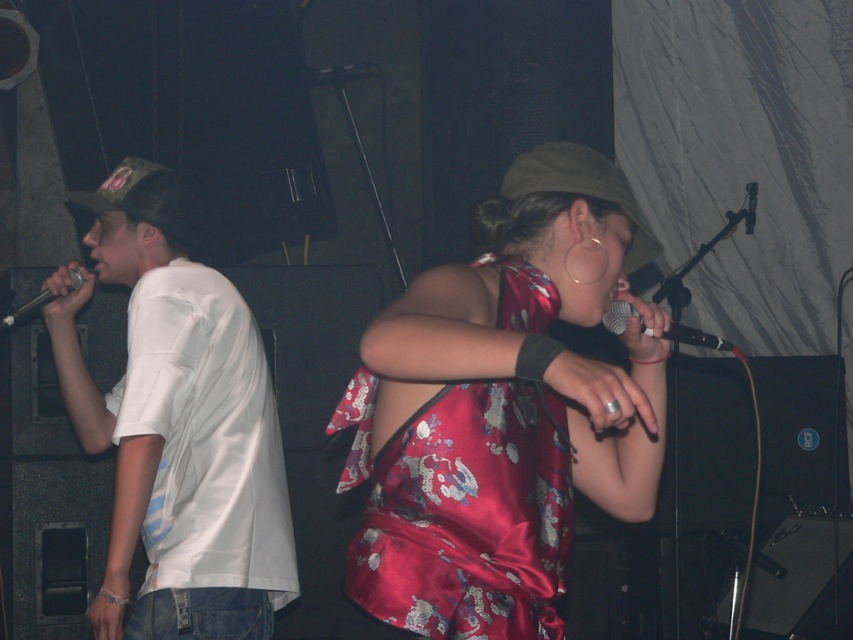
Is white satin shirt at left shorter than matte black microphone at left?

Incorrect, white satin shirt at left's height does not fall short of matte black microphone at left's.

Does point (62, 307) come farther from viewer compared to point (39, 304)?

No, (62, 307) is closer to viewer.

At what (x,y) coordinates should I click in order to perform the action: click on white satin shirt at left. Please return your answer as a coordinate pair (x, y). The height and width of the screenshot is (640, 853). Looking at the image, I should click on coord(177,424).

Is satin dress at center positioned before black matte microphone at center?

Yes, satin dress at center is closer to the viewer.

Which is more to the left, satin dress at center or black matte microphone at center?

satin dress at center

Find the location of a particular element. The height and width of the screenshot is (640, 853). satin dress at center is located at coordinates (461, 509).

Find the location of a particular element. The image size is (853, 640). satin dress at center is located at coordinates (461, 509).

Is the position of satin dress at center less distant than that of matte black microphone at left?

Yes, it is in front of matte black microphone at left.

Is the position of satin dress at center more distant than that of matte black microphone at left?

That is False.

Describe the element at coordinates (461, 509) in the screenshot. I see `satin dress at center` at that location.

Identify the location of satin dress at center. (461, 509).